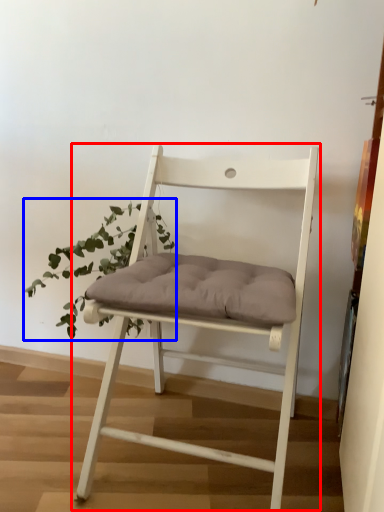
Question: Which object is closer to the camera taking this photo, chair (highlighted by a red box) or houseplant (highlighted by a blue box)?

Choices:
 (A) chair
 (B) houseplant

Answer: (A)